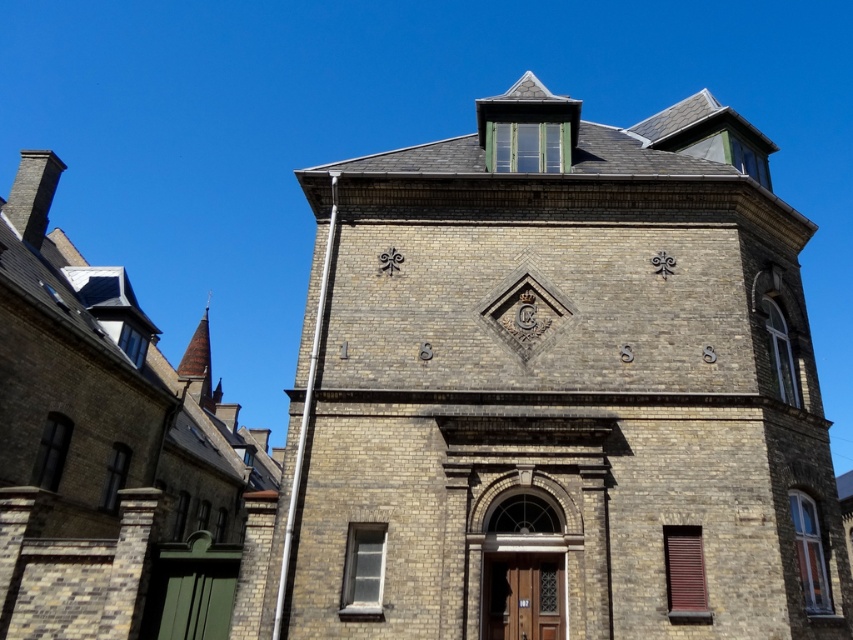
Can you confirm if brown brick church at left is positioned to the left of smooth copper spire at upper left?

No, brown brick church at left is not to the left of smooth copper spire at upper left.

Can you confirm if brown brick church at left is positioned above smooth copper spire at upper left?

Yes, brown brick church at left is above smooth copper spire at upper left.

Is point (6, 314) closer to viewer compared to point (202, 330)?

Yes, point (6, 314) is in front of point (202, 330).

Image resolution: width=853 pixels, height=640 pixels. I want to click on brown brick church at left, so click(x=108, y=451).

Which is above, brown brick tower at center or smooth copper spire at upper left?

Positioned higher is brown brick tower at center.

Identify the location of brown brick tower at center. (556, 390).

The height and width of the screenshot is (640, 853). I want to click on brown brick tower at center, so click(x=556, y=390).

Is point (587, 284) farther from camera compared to point (48, 397)?

No.

Is point (775, 557) less distant than point (138, 618)?

Yes, point (775, 557) is closer to viewer.

Is point (570, 230) closer to camera compared to point (45, 490)?

That is False.

The width and height of the screenshot is (853, 640). I want to click on brown brick tower at center, so click(x=556, y=390).